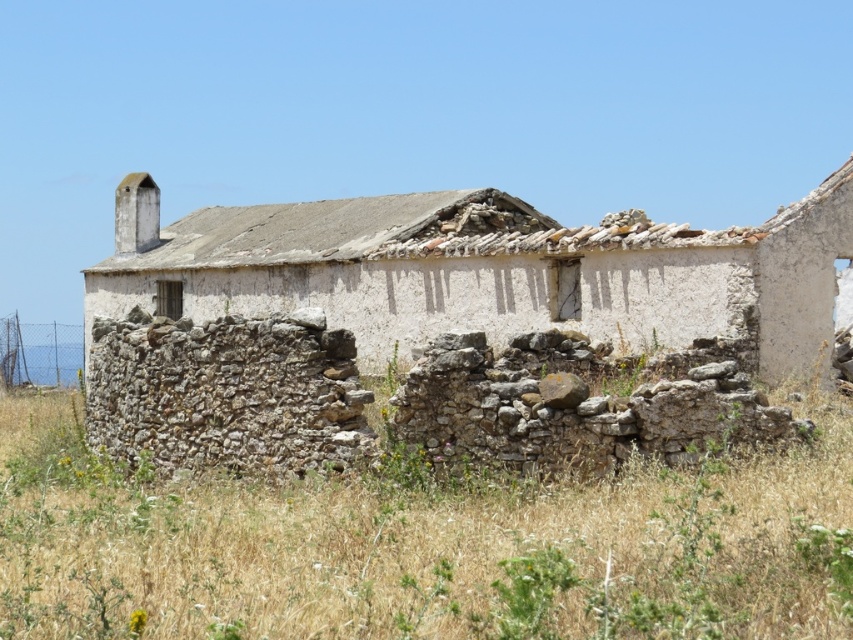
You are standing in front of the old stone building and want to place a small garden. Where should you place it so that it aligns with the dry grass at lower center?

The dry grass at lower center is located at the 2D coordinates point (421,547), so you should place the garden at that point to align with it.

You are standing in front of the old stone building and notice two points marked on its walls. The first point is at coordinates point (732, 630) and the second is at point (492, 305). Which of these points is closer to you?

Point (732, 630) is closer to the viewer than point (492, 305).